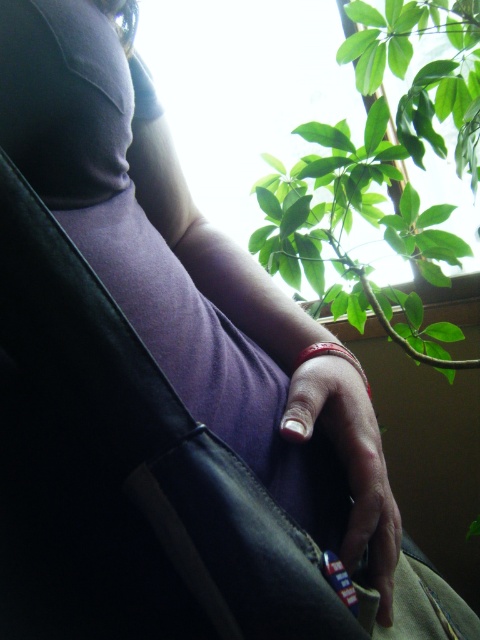
Who is more distant from viewer, (384, 532) or (303, 349)?

Point (303, 349)

Which is in front, point (396, 506) or point (300, 364)?

Point (300, 364) is in front.

The image size is (480, 640). I want to click on white matte nail at center, so click(x=350, y=460).

Measure the distance from green leafy plant at upper right to white matte nail at center.

A distance of 35.24 inches exists between green leafy plant at upper right and white matte nail at center.

Who is more distant from viewer, [346,262] or [300,388]?

The point [346,262] is behind.

Who is more forward, (409, 330) or (321, 355)?

Point (321, 355) is more forward.

Image resolution: width=480 pixels, height=640 pixels. I want to click on green leafy plant at upper right, so click(364, 168).

Can you confirm if green leafy plant at upper right is positioned to the left of red leather bracelet at center?

In fact, green leafy plant at upper right is to the right of red leather bracelet at center.

Is green leafy plant at upper right to the right of red leather bracelet at center from the viewer's perspective?

Indeed, green leafy plant at upper right is positioned on the right side of red leather bracelet at center.

Identify the location of green leafy plant at upper right. Image resolution: width=480 pixels, height=640 pixels. (364, 168).

The width and height of the screenshot is (480, 640). In order to click on green leafy plant at upper right in this screenshot , I will do `click(364, 168)`.